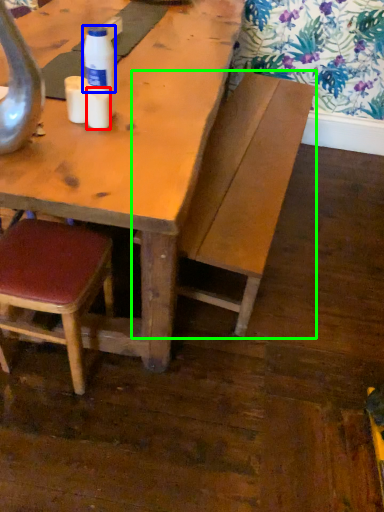
Question: Estimate the real-world distances between objects in this image. Which object is farther from coffee cup (highlighted by a red box), bottle (highlighted by a blue box) or bench (highlighted by a green box)?

Choices:
 (A) bottle
 (B) bench

Answer: (B)